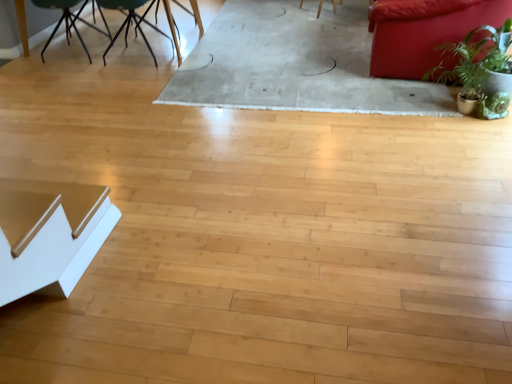
Question: Does metallic black table at upper left turn towards matte red couch at upper right?

Choices:
 (A) yes
 (B) no

Answer: (B)

Question: Can you confirm if metallic black table at upper left is smaller than matte red couch at upper right?

Choices:
 (A) yes
 (B) no

Answer: (B)

Question: Does metallic black table at upper left appear on the left side of matte red couch at upper right?

Choices:
 (A) yes
 (B) no

Answer: (A)

Question: Is there a large distance between metallic black table at upper left and matte red couch at upper right?

Choices:
 (A) no
 (B) yes

Answer: (B)

Question: From a real-world perspective, is metallic black table at upper left positioned over matte red couch at upper right based on gravity?

Choices:
 (A) no
 (B) yes

Answer: (A)

Question: Do you think green leafy plant at right is within white glossy table at lower left, or outside of it?

Choices:
 (A) inside
 (B) outside

Answer: (B)

Question: Based on their positions, is green leafy plant at right located to the left or right of white glossy table at lower left?

Choices:
 (A) right
 (B) left

Answer: (A)

Question: Considering the positions of green leafy plant at right and white glossy table at lower left in the image, is green leafy plant at right wider or thinner than white glossy table at lower left?

Choices:
 (A) wide
 (B) thin

Answer: (A)

Question: In terms of size, does green leafy plant at right appear bigger or smaller than white glossy table at lower left?

Choices:
 (A) big
 (B) small

Answer: (A)

Question: From the image's perspective, relative to green matte chair at upper left, the second chair viewed from the right, is matte red couch at upper right above or below?

Choices:
 (A) below
 (B) above

Answer: (A)

Question: Is matte red couch at upper right bigger or smaller than green matte chair at upper left, which ranks as the first chair in left-to-right order?

Choices:
 (A) small
 (B) big

Answer: (B)

Question: Considering the relative positions of matte red couch at upper right and green matte chair at upper left, the second chair viewed from the right, in the image provided, is matte red couch at upper right to the left or to the right of green matte chair at upper left, the second chair viewed from the right,?

Choices:
 (A) left
 (B) right

Answer: (B)

Question: Considering the positions of matte red couch at upper right and green matte chair at upper left, the second chair viewed from the right, in the image, is matte red couch at upper right taller or shorter than green matte chair at upper left, the second chair viewed from the right,?

Choices:
 (A) short
 (B) tall

Answer: (B)

Question: Considering their positions, is green matte chair at upper left, which is the 1th chair in right-to-left order, located in front of or behind green leafy plant at right?

Choices:
 (A) behind
 (B) front

Answer: (A)

Question: In terms of height, does green matte chair at upper left, which is the 2th chair in left-to-right order, look taller or shorter compared to green leafy plant at right?

Choices:
 (A) short
 (B) tall

Answer: (B)